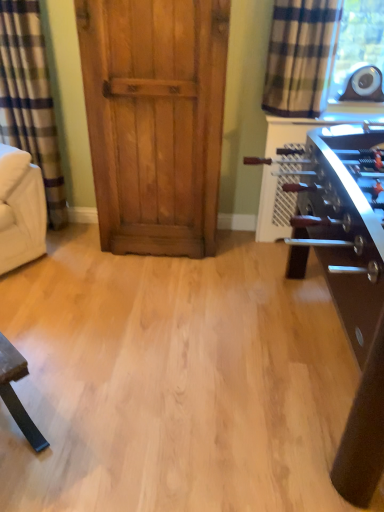
Locate an element on the screen. free space in front of wooden door at center is located at coordinates (149, 287).